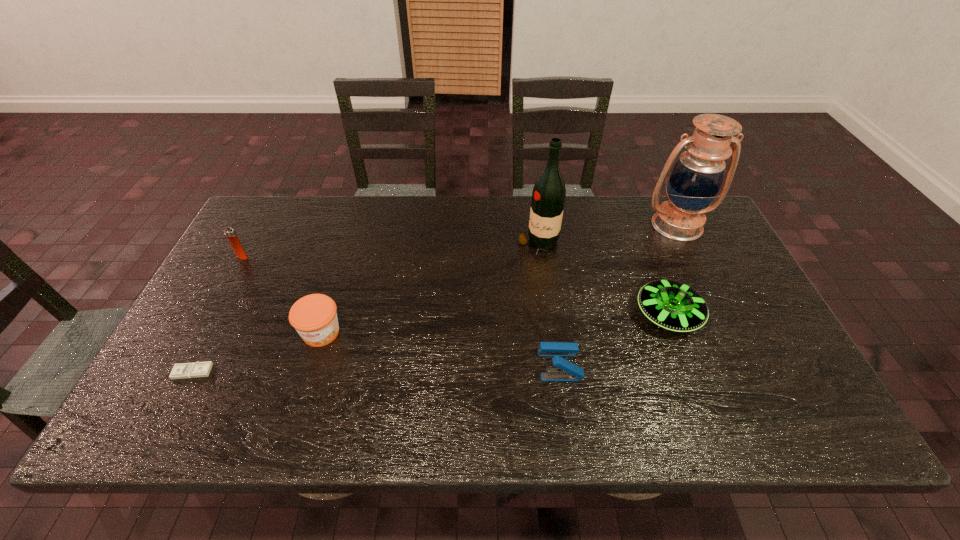
Locate an element on the screen. This screenshot has height=540, width=960. free space located on the front label of the jam is located at coordinates (289, 435).

Image resolution: width=960 pixels, height=540 pixels. Find the location of `free space located 0.180m on the back of the saucer`. free space located 0.180m on the back of the saucer is located at coordinates coord(641,247).

This screenshot has width=960, height=540. I want to click on vacant space located 0.120m on the left of the stapler, so click(488, 365).

This screenshot has height=540, width=960. Identify the location of free point located 0.250m on the back of the shortest object. (237, 286).

The width and height of the screenshot is (960, 540). Find the location of `oil lamp situated at the far edge`. oil lamp situated at the far edge is located at coordinates (697, 176).

Locate an element on the screen. The width and height of the screenshot is (960, 540). wine bottle present at the far edge is located at coordinates (549, 193).

Identify the location of igniter that is positioned at the left edge. The height and width of the screenshot is (540, 960). (229, 232).

You are a GUI agent. You are given a task and a screenshot of the screen. Output one action in this format:
    pyautogui.click(x=<x>, y=<y>)
    Task: Click on the money located in the left edge section of the desktop
    
    Given the screenshot: What is the action you would take?
    pyautogui.click(x=198, y=369)

At what (x,y) coordinates should I click in order to perform the action: click on object present at the right edge. Please return your answer as a coordinate pair (x, y). This screenshot has width=960, height=540. Looking at the image, I should click on (697, 176).

What are the coordinates of `object at the far right corner` in the screenshot? It's located at (697, 176).